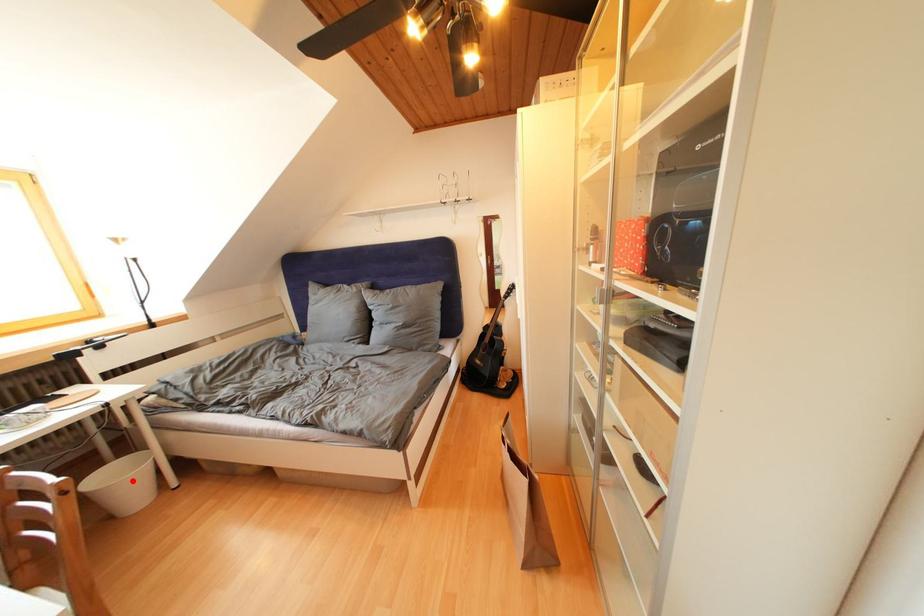
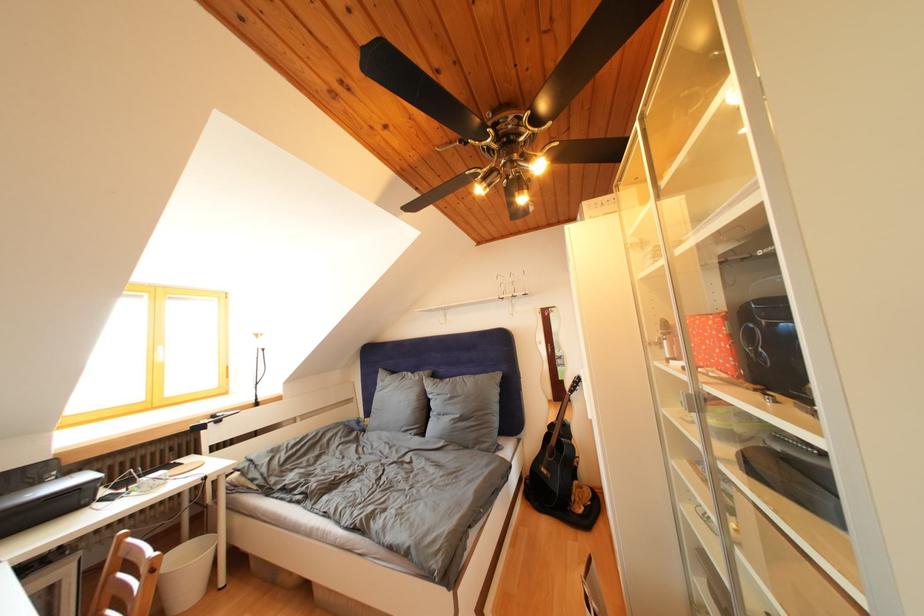
Where in the second image is the point corresponding to the highlighted location from the first image?

(198, 565)